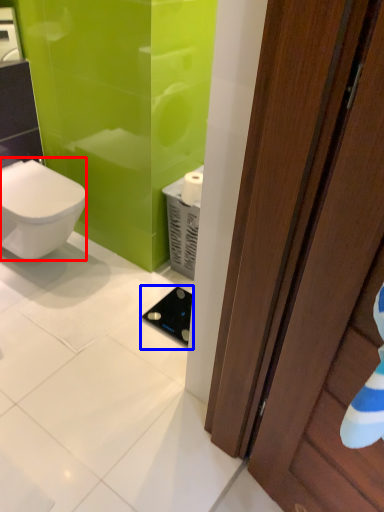
Question: Which object is further to the camera taking this photo, bidet (highlighted by a red box) or appliance (highlighted by a blue box)?

Choices:
 (A) bidet
 (B) appliance

Answer: (B)